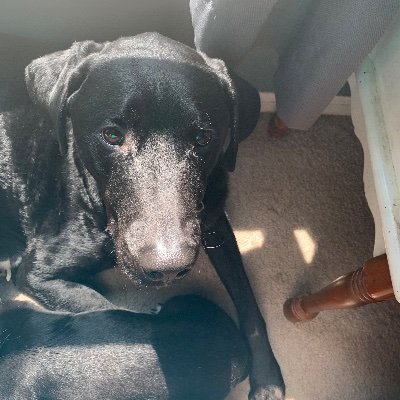
I want to click on wall, so click(x=98, y=17).